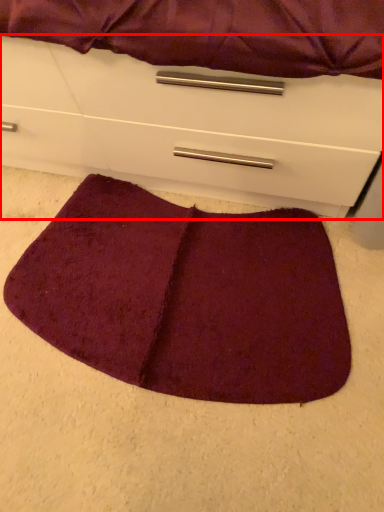
Question: Observing the image, what is the correct spatial positioning of chest of drawers (annotated by the red box) in reference to mat?

Choices:
 (A) right
 (B) left

Answer: (B)